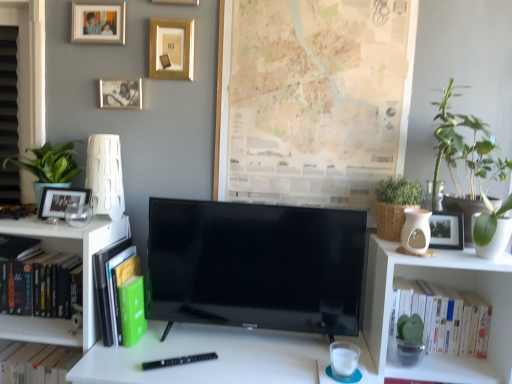
I want to click on vacant area located to the right-hand side of green matte book at left, the second book from the right, so click(x=170, y=344).